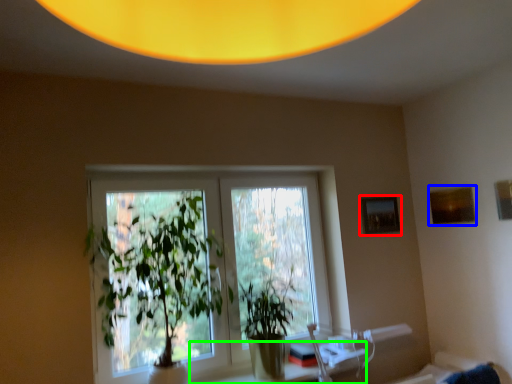
Question: Based on their relative distances, which object is nearer to picture frame (highlighted by a red box)? Choose from picture frame (highlighted by a blue box) and table (highlighted by a green box).

Choices:
 (A) picture frame
 (B) table

Answer: (A)